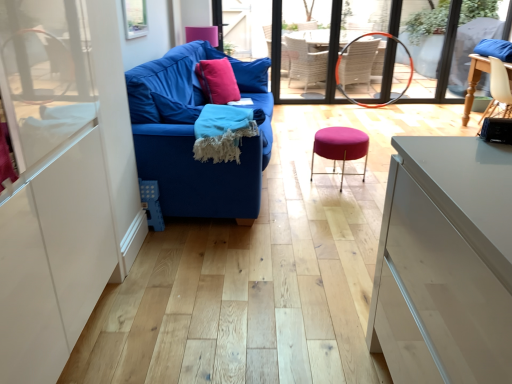
Question: Is purple fabric stool at center shorter than matte pink throw pillow at center?

Choices:
 (A) no
 (B) yes

Answer: (A)

Question: Is purple fabric stool at center looking in the opposite direction of matte pink throw pillow at center?

Choices:
 (A) yes
 (B) no

Answer: (B)

Question: Are purple fabric stool at center and matte pink throw pillow at center far apart?

Choices:
 (A) no
 (B) yes

Answer: (B)

Question: Could you tell me if purple fabric stool at center is facing matte pink throw pillow at center?

Choices:
 (A) no
 (B) yes

Answer: (A)

Question: Can you confirm if purple fabric stool at center is positioned to the right of matte pink throw pillow at center?

Choices:
 (A) no
 (B) yes

Answer: (B)

Question: Does point (292, 46) appear closer or farther from the camera than point (332, 157)?

Choices:
 (A) farther
 (B) closer

Answer: (A)

Question: Based on their positions, is orange rubber hula hoop at center located to the left or right of purple fabric stool at center?

Choices:
 (A) right
 (B) left

Answer: (A)

Question: Considering their positions, is orange rubber hula hoop at center located in front of or behind purple fabric stool at center?

Choices:
 (A) behind
 (B) front

Answer: (A)

Question: Looking at the image, does orange rubber hula hoop at center seem bigger or smaller compared to purple fabric stool at center?

Choices:
 (A) big
 (B) small

Answer: (A)

Question: Is matte wicker armchair at center to the left or to the right of wooden chair at right in the image?

Choices:
 (A) right
 (B) left

Answer: (B)

Question: Based on their sizes in the image, would you say matte wicker armchair at center is bigger or smaller than wooden chair at right?

Choices:
 (A) big
 (B) small

Answer: (A)

Question: Considering the positions of matte wicker armchair at center and wooden chair at right in the image, is matte wicker armchair at center taller or shorter than wooden chair at right?

Choices:
 (A) tall
 (B) short

Answer: (A)

Question: Considering the positions of point (340, 84) and point (495, 74), is point (340, 84) closer or farther from the camera than point (495, 74)?

Choices:
 (A) closer
 (B) farther

Answer: (B)

Question: Considering their positions, is matte wicker armchair at center located in front of or behind blue fabric couch at left?

Choices:
 (A) front
 (B) behind

Answer: (B)

Question: From their relative heights in the image, would you say matte wicker armchair at center is taller or shorter than blue fabric couch at left?

Choices:
 (A) tall
 (B) short

Answer: (A)